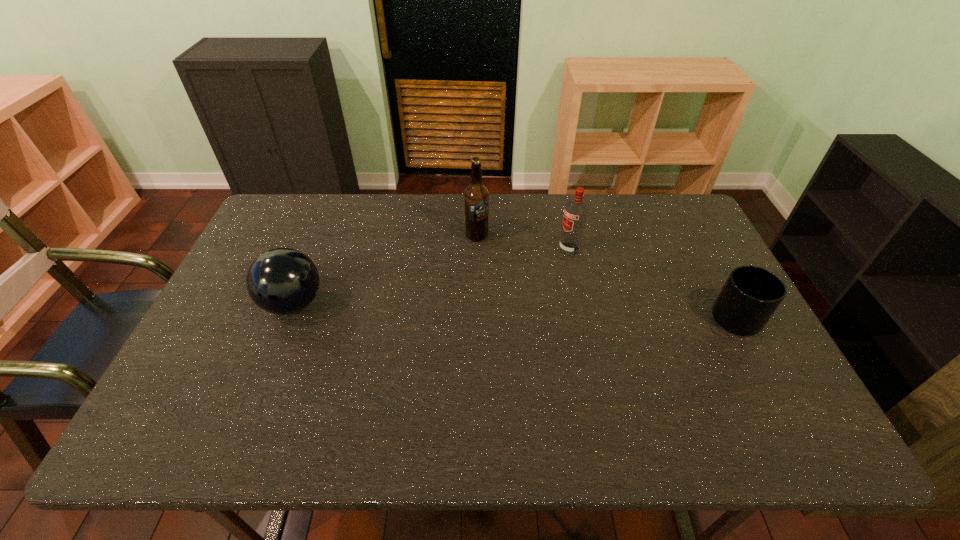
The height and width of the screenshot is (540, 960). What are the coordinates of `vacant space at the left edge` in the screenshot? It's located at (219, 311).

At what (x,y) coordinates should I click in order to perform the action: click on free location at the right edge. Please return your answer as a coordinate pair (x, y). Looking at the image, I should click on (716, 268).

Locate an element on the screen. Image resolution: width=960 pixels, height=540 pixels. free space at the far left corner of the desktop is located at coordinates (293, 227).

In the image, there is a desktop. Find the location of `vacant space at the far right corner`. vacant space at the far right corner is located at coordinates (664, 224).

Where is `free spot between the leftmost object and the second tallest object`? The width and height of the screenshot is (960, 540). free spot between the leftmost object and the second tallest object is located at coordinates (431, 276).

Where is `vacant area that lies between the third shortest object and the shortest object`? This screenshot has width=960, height=540. vacant area that lies between the third shortest object and the shortest object is located at coordinates [x=657, y=284].

At what (x,y) coordinates should I click in order to perform the action: click on free point between the beer bottle and the bowling ball. Please return your answer as a coordinate pair (x, y). The height and width of the screenshot is (540, 960). Looking at the image, I should click on (385, 269).

Where is `vacant region between the rightmost object and the tallest object`? vacant region between the rightmost object and the tallest object is located at coordinates (611, 277).

Where is `free spot between the second tallest object and the third object from right to left`? free spot between the second tallest object and the third object from right to left is located at coordinates (523, 242).

The height and width of the screenshot is (540, 960). What are the coordinates of `free space between the third shortest object and the rightmost object` in the screenshot? It's located at (657, 284).